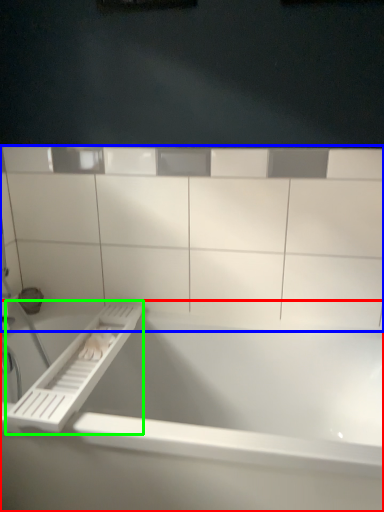
Question: Estimate the real-world distances between objects in this image. Which object is farther from bathtub (highlighted by a red box), ledge (highlighted by a blue box) or towel bar (highlighted by a green box)?

Choices:
 (A) ledge
 (B) towel bar

Answer: (A)